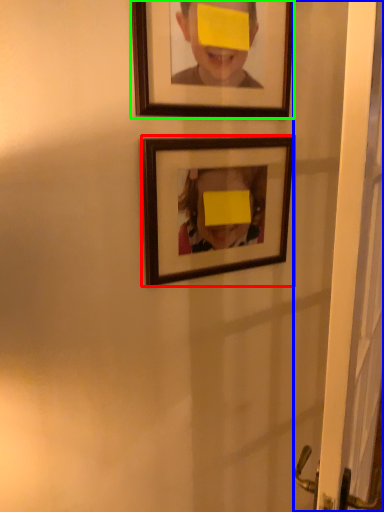
Question: Based on their relative distances, which object is farther from picture frame (highlighted by a red box)? Choose from screen door (highlighted by a blue box) and picture frame (highlighted by a green box).

Choices:
 (A) screen door
 (B) picture frame

Answer: (A)